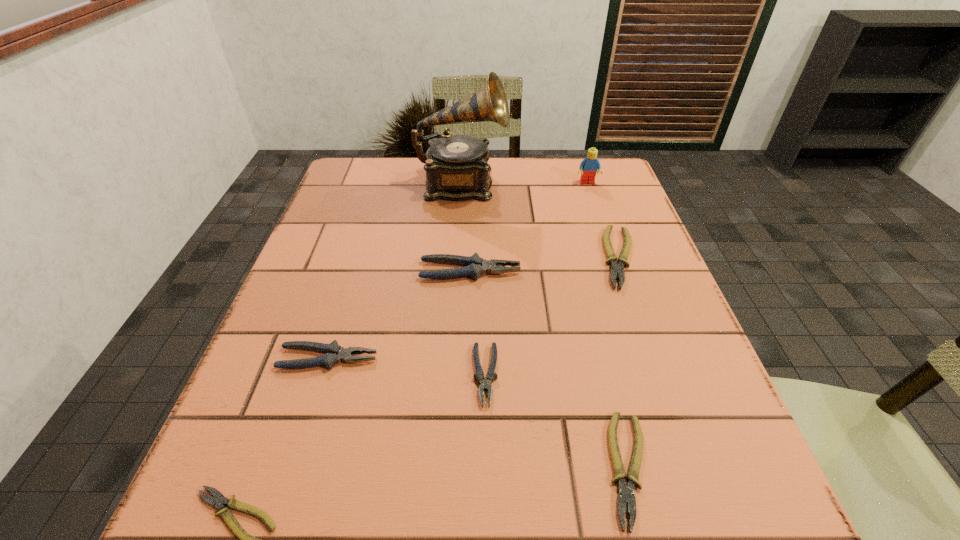
Find the location of a particular element. vacant space that satisfies the following two spatial constraints: 1. on the back side of the second shortest pliers; 2. on the horn of the tallest object is located at coordinates (559, 185).

The width and height of the screenshot is (960, 540). I want to click on vacant region that satisfies the following two spatial constraints: 1. at the gripping part of the second shortest object; 2. on the left side of the second biggest gray pliers, so click(x=294, y=469).

The width and height of the screenshot is (960, 540). Find the location of `vacant region that satisfies the following two spatial constraints: 1. on the horn of the second pliers from right to left; 2. on the right side of the tallest object`. vacant region that satisfies the following two spatial constraints: 1. on the horn of the second pliers from right to left; 2. on the right side of the tallest object is located at coordinates (444, 469).